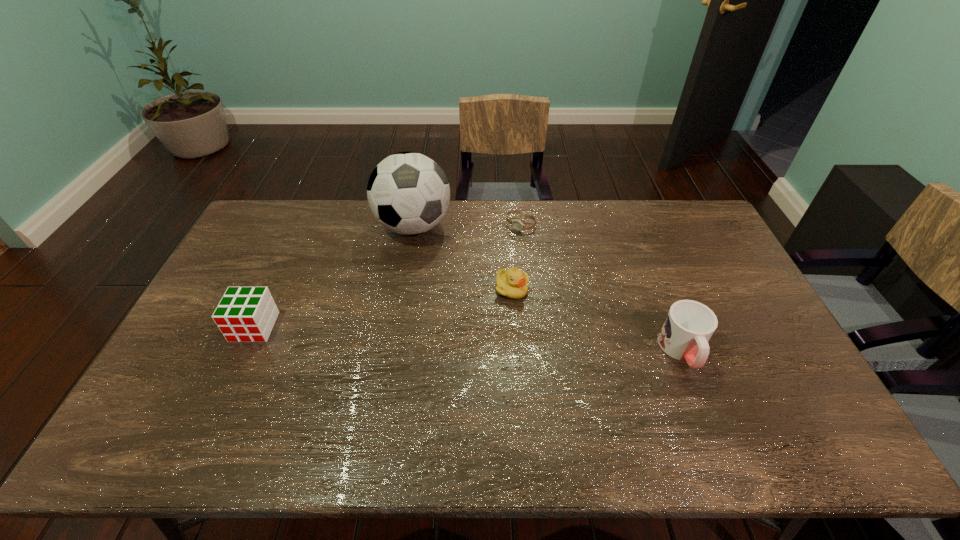
Identify the location of vacant space in between the duckling and the cube. The height and width of the screenshot is (540, 960). (383, 308).

Find the location of a particular element. This screenshot has height=540, width=960. empty location between the watch and the cube is located at coordinates (388, 276).

Locate an element on the screen. This screenshot has width=960, height=540. free spot between the soccer ball and the third farthest object is located at coordinates (463, 258).

This screenshot has height=540, width=960. Find the location of `free area in between the mug and the cube`. free area in between the mug and the cube is located at coordinates (468, 339).

The width and height of the screenshot is (960, 540). What are the coordinates of `vacant space that is in between the shortest object and the leftmost object` in the screenshot? It's located at (388, 276).

Locate an element on the screen. This screenshot has height=540, width=960. object that can be found as the closest to the watch is located at coordinates (408, 193).

Where is `object identified as the second closest to the leftmost object`? object identified as the second closest to the leftmost object is located at coordinates (513, 283).

Where is `free space that satisfies the following two spatial constraints: 1. on the front side of the third nearest object; 2. on the left side of the fourth object from right to left`? The height and width of the screenshot is (540, 960). free space that satisfies the following two spatial constraints: 1. on the front side of the third nearest object; 2. on the left side of the fourth object from right to left is located at coordinates (403, 289).

The width and height of the screenshot is (960, 540). In order to click on free space in the image that satisfies the following two spatial constraints: 1. on the back side of the shortest object; 2. on the right side of the soccer ball in this screenshot , I will do `click(414, 225)`.